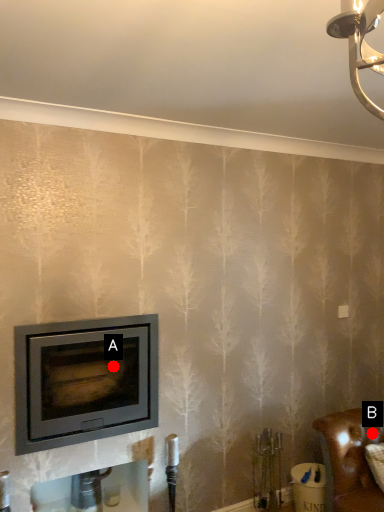
Question: Two points are circled on the image, labeled by A and B beside each circle. Which point appears closest to the camera in this image?

Choices:
 (A) A is closer
 (B) B is closer

Answer: (B)